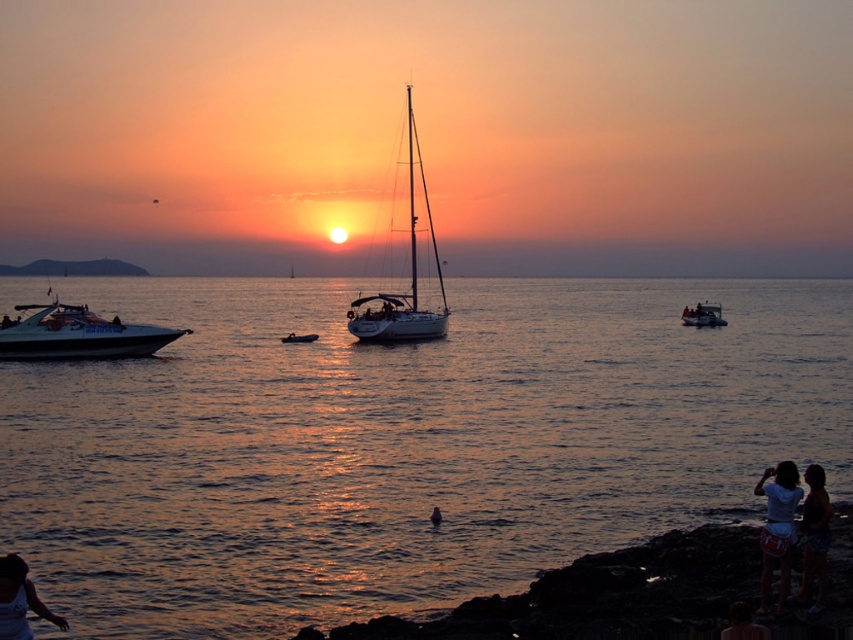
Who is more distant from viewer, (56,310) or (820,588)?

The point (56,310) is behind.

Does point (49, 333) come closer to viewer compared to point (820, 600)?

That is False.

Who is more distant from viewer, (79, 346) or (822, 572)?

Point (79, 346)

Find the location of a particular element. white glossy speedboat at left is located at coordinates (78, 333).

The image size is (853, 640). What do you see at coordinates (815, 536) in the screenshot?
I see `white cotton shorts at lower right` at bounding box center [815, 536].

Between white cotton shorts at lower right and dark hair at lower left, which one has more height?

white cotton shorts at lower right

Does point (814, 500) lie in front of point (21, 564)?

That is False.

At what (x,y) coordinates should I click in order to perform the action: click on white cotton shorts at lower right. Please return your answer as a coordinate pair (x, y). This screenshot has width=853, height=640. Looking at the image, I should click on (815, 536).

Between point (801, 593) and point (746, 632), which one is positioned behind?

The point (801, 593) is behind.

Is white cotton shorts at lower right wider than smooth skin person at lower right?

Correct, the width of white cotton shorts at lower right exceeds that of smooth skin person at lower right.

Who is more distant from viewer, (813, 561) or (753, 636)?

The point (813, 561) is more distant.

Find the location of a particular element. This screenshot has width=853, height=640. white cotton shorts at lower right is located at coordinates (815, 536).